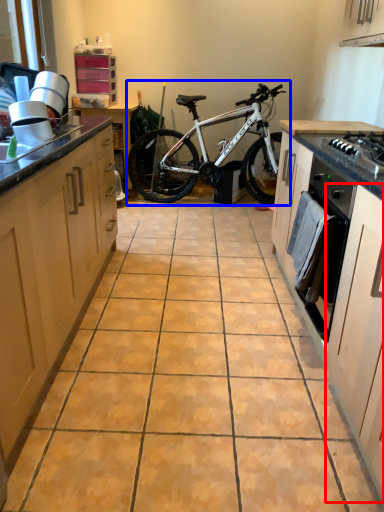
Question: Among these objects, which one is farthest to the camera, cabinetry (highlighted by a red box) or bicycle (highlighted by a blue box)?

Choices:
 (A) cabinetry
 (B) bicycle

Answer: (B)